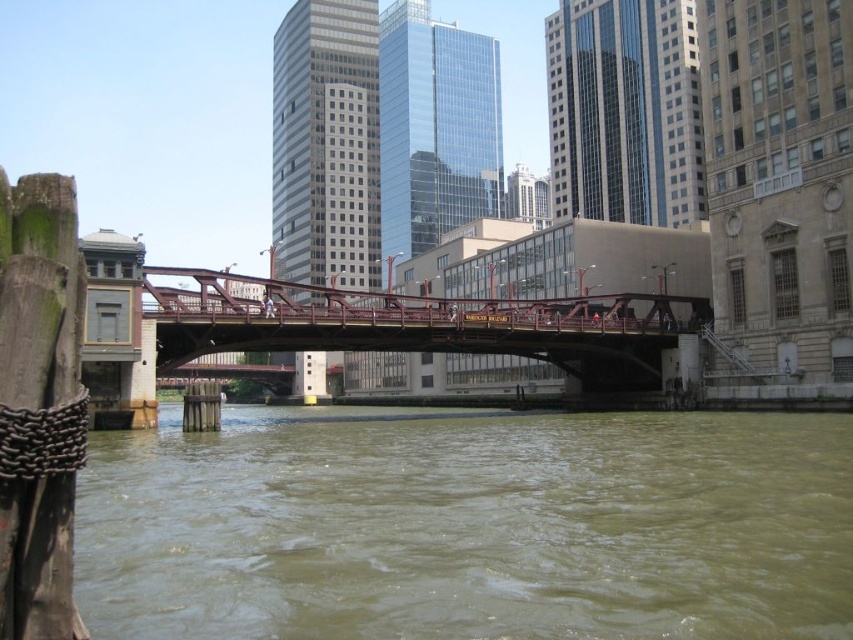
What do you see at coordinates (468, 525) in the screenshot?
I see `brown murky water at center` at bounding box center [468, 525].

Is brown murky water at center positioned before rusty metal bridge at center?

Yes, it is.

Is point (312, 454) positioned in front of point (260, 332)?

Yes, point (312, 454) is closer to viewer.

Where is `brown murky water at center`? The width and height of the screenshot is (853, 640). brown murky water at center is located at coordinates (468, 525).